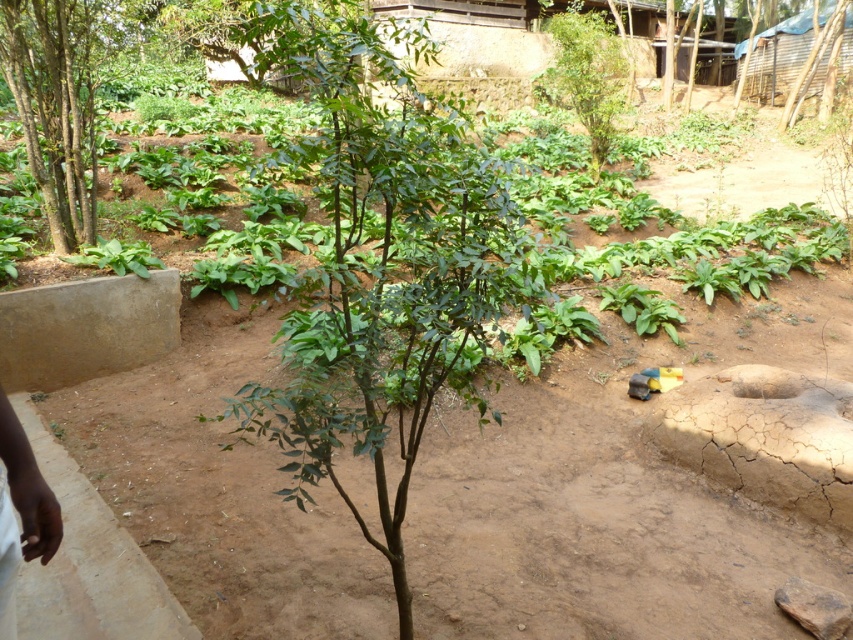
In the scene shown: You are standing in the garden and want to water the green leafy tree at center and the green leafy tree at left. Which tree should you water first if you want to start from the left side of the garden?

You should water the green leafy tree at left first because it is positioned to the left of the green leafy tree at center.

You are standing at the origin point of the image. Which direction should you move to reach the green leafy tree at center?

The green leafy tree at center is located at coordinates point (383,266), so you should move towards the center of the image to reach it.

You are a gardener who needs to plant a new tree between the green leafy tree at center and the green leafy tree at upper center. The new tree requires at least 10 meters of space between it and any existing trees. Is there enough space between the two existing trees to accommodate the new tree?

The green leafy tree at center and the green leafy tree at upper center are 10.18 meters apart, which is more than the required 10 meters. Therefore, there is enough space to plant the new tree between them.